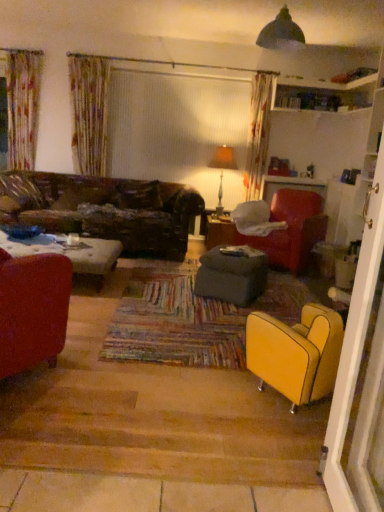
What are the coordinates of `vacant area that lies to the right of matte red armchair at left, positioned as the first chair in front-to-back order` in the screenshot? It's located at (102, 385).